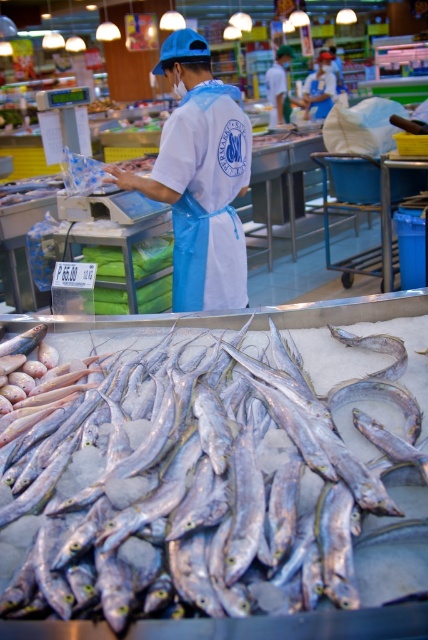
Question: Can you confirm if silvery metallic fish at center is positioned above blue fabric apron at center?

Choices:
 (A) no
 (B) yes

Answer: (A)

Question: Estimate the real-world distances between objects in this image. Which object is farther from the blue fabric apron at center?

Choices:
 (A) blue apron at center
 (B) silvery metallic fish at center

Answer: (A)

Question: Can you confirm if blue fabric apron at center is positioned below blue apron at center?

Choices:
 (A) no
 (B) yes

Answer: (B)

Question: In this image, where is silvery metallic fish at center located relative to blue fabric apron at center?

Choices:
 (A) left
 (B) right

Answer: (B)

Question: Which of these objects is positioned closest to the silvery metallic fish at center?

Choices:
 (A) blue apron at center
 (B) blue fabric apron at center

Answer: (B)

Question: Which of the following is the farthest from the observer?

Choices:
 (A) (x=240, y=282)
 (B) (x=308, y=84)

Answer: (B)